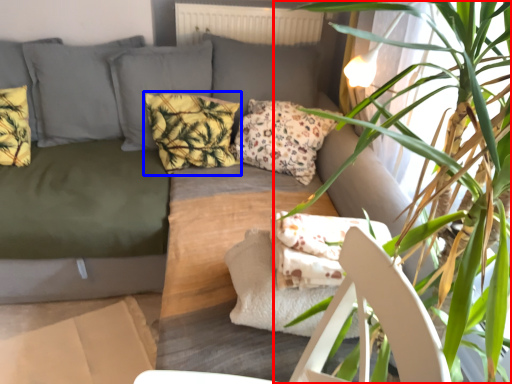
Question: Which point is further to the camera, houseplant (highlighted by a red box) or pillow (highlighted by a blue box)?

Choices:
 (A) houseplant
 (B) pillow

Answer: (B)